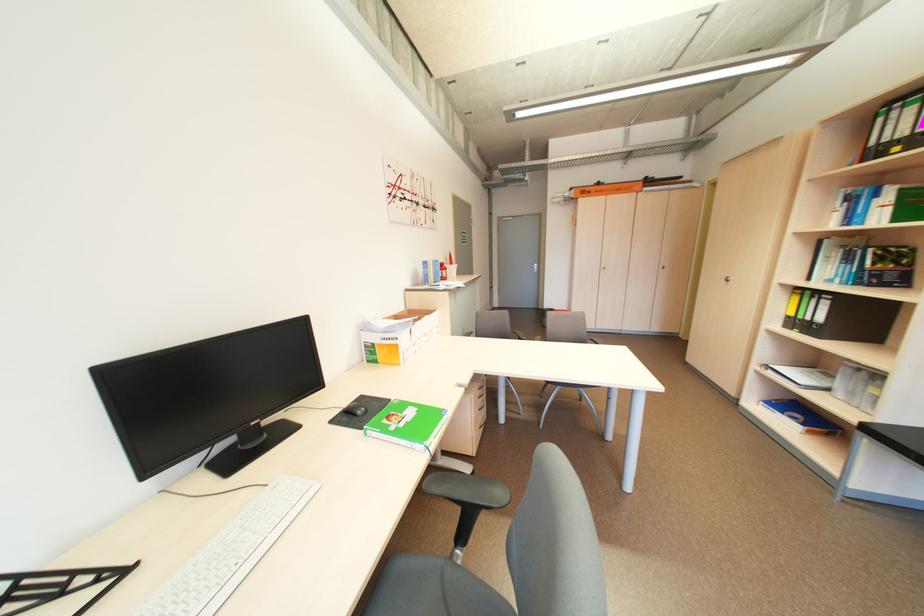
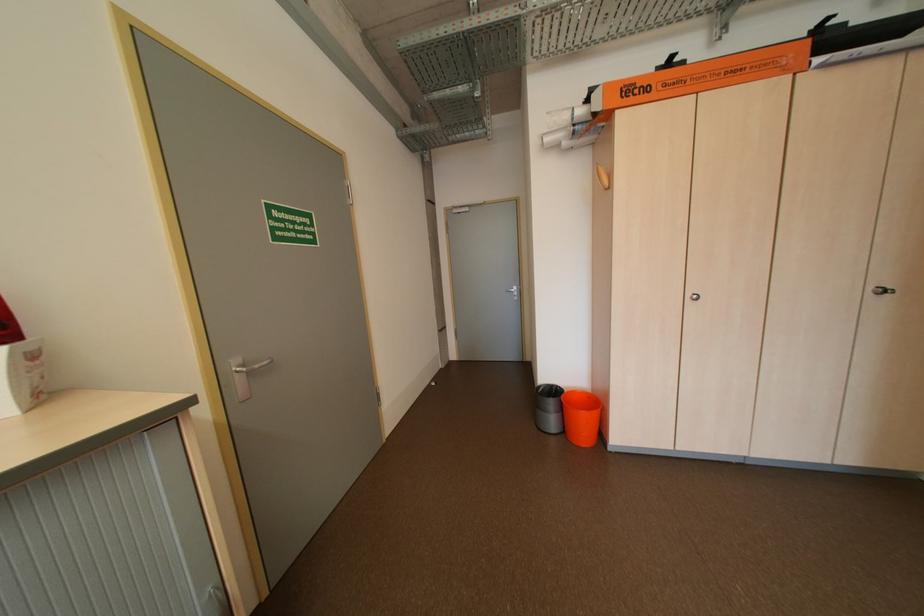
Question: The images are taken continuously from a first-person perspective. In which direction are you moving?

Choices:
 (A) Left
 (B) Right
 (C) Forward
 (D) Backward

Answer: (C)